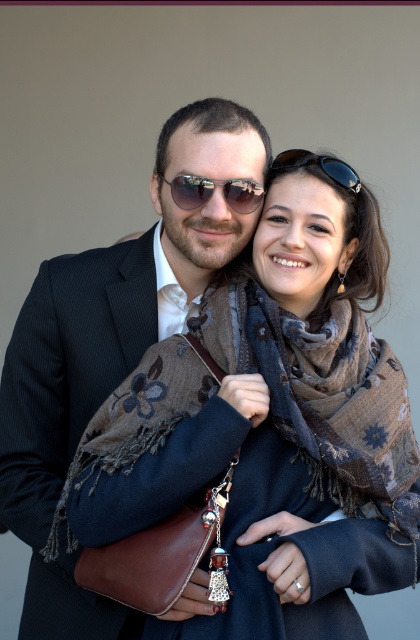
Question: Estimate the real-world distances between objects in this image. Which object is farther from the black reflective sunglasses at upper center?

Choices:
 (A) matte black sunglasses at center
 (B) brown textured scarf at center

Answer: (B)

Question: Is matte black sunglasses at center in front of black reflective sunglasses at upper center?

Choices:
 (A) yes
 (B) no

Answer: (A)

Question: Is brown textured scarf at center smaller than matte black sunglasses at center?

Choices:
 (A) no
 (B) yes

Answer: (A)

Question: Which point appears farthest from the camera in this image?

Choices:
 (A) (338, 172)
 (B) (189, 182)

Answer: (A)

Question: Can you confirm if matte black sunglasses at center is thinner than black reflective sunglasses at upper center?

Choices:
 (A) no
 (B) yes

Answer: (B)

Question: Which point is farther from the camera taking this photo?

Choices:
 (A) (257, 291)
 (B) (298, 148)
 (C) (188, 193)

Answer: (B)